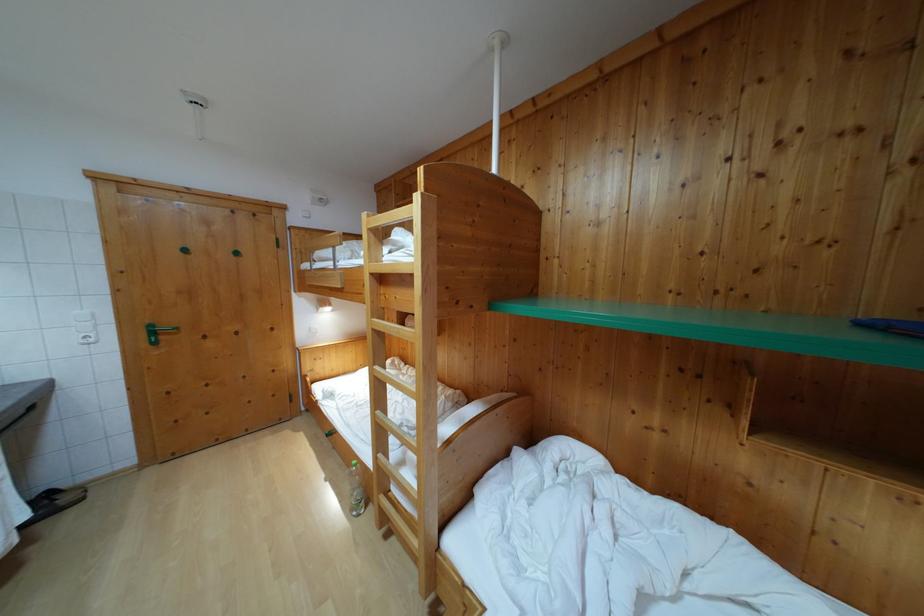
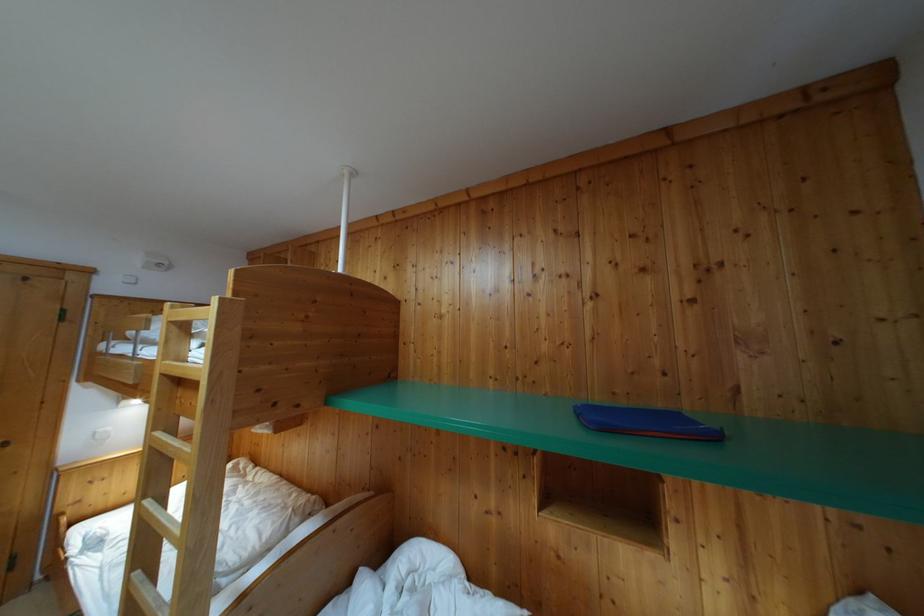
Question: The images are taken continuously from a first-person perspective. In which direction is your viewpoint rotating?

Choices:
 (A) Left
 (B) Right
 (C) Up
 (D) Down

Answer: (B)